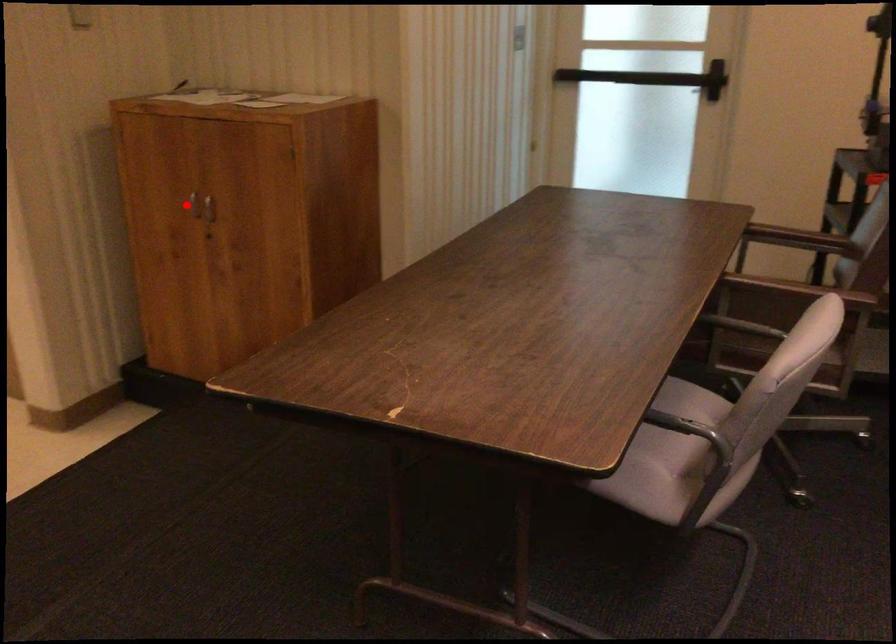
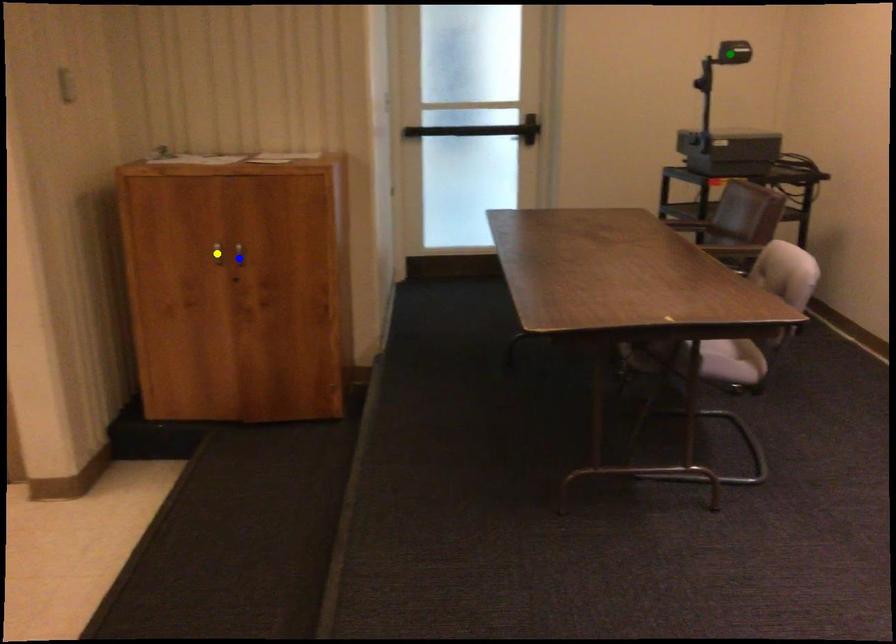
Question: I am providing you with two images of the same scene from different viewpoints. A red point is marked on the first image. You are given multiple points on the second image. Which mark in image 2 goes with the point in image 1?

Choices:
 (A) blue point
 (B) green point
 (C) yellow point

Answer: (C)